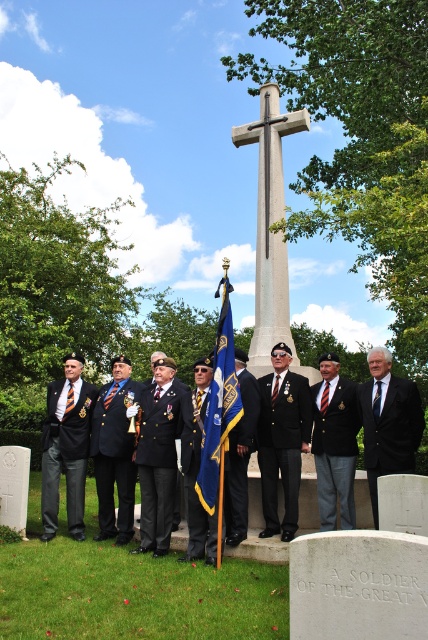
Does dark blue woolen suit at center have a lesser width compared to dark blue wool suit at left?

Yes, dark blue woolen suit at center is thinner than dark blue wool suit at left.

Which is in front, point (162, 534) or point (61, 412)?

Point (162, 534)

Image resolution: width=428 pixels, height=640 pixels. What are the coordinates of `dark blue woolen suit at center` in the screenshot? It's located at (157, 465).

Which is more to the right, shiny black suit at center or black satin flag at center?

black satin flag at center

Identify the location of shiny black suit at center. The width and height of the screenshot is (428, 640). (115, 452).

Does shiny black suit at center have a lesser height compared to dark blue wool suit at left?

Incorrect, shiny black suit at center's height does not fall short of dark blue wool suit at left's.

This screenshot has height=640, width=428. I want to click on shiny black suit at center, so (x=115, y=452).